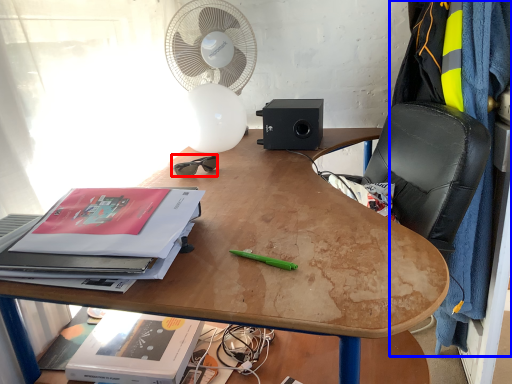
Question: Which of the following is the closest to the observer, glasses (highlighted by a red box) or blanket (highlighted by a blue box)?

Choices:
 (A) glasses
 (B) blanket

Answer: (B)